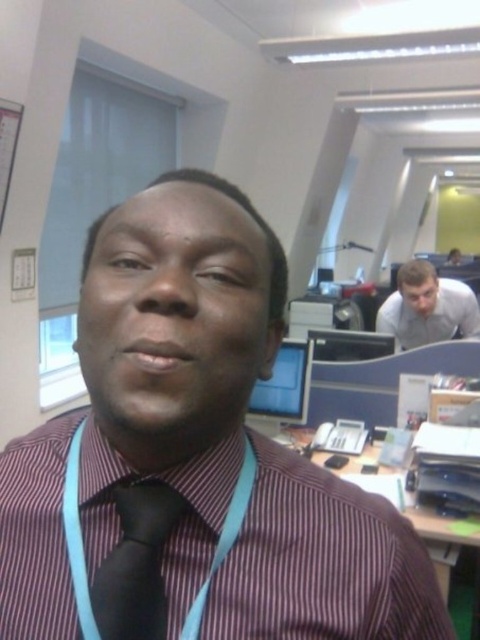
Between point (362, 589) and point (479, 545), which one is positioned behind?

Point (479, 545)

Is striped cotton shirt at center to the right of wooden desk at center from the viewer's perspective?

In fact, striped cotton shirt at center is to the left of wooden desk at center.

Who is more forward, (264, 496) or (302, 428)?

Point (264, 496)

Image resolution: width=480 pixels, height=640 pixels. Find the location of `striped cotton shirt at center`. striped cotton shirt at center is located at coordinates (322, 563).

Is maroon striped shirt at center thinner than white glossy shirt at upper right?

Yes.

Who is more distant from viewer, [251,588] or [400,333]?

The point [400,333] is behind.

Does point (212, 356) come farther from viewer compared to point (388, 332)?

No.

The image size is (480, 640). I want to click on maroon striped shirt at center, so click(192, 458).

Does white glossy shirt at upper right have a greater width compared to matte black monitor at center?

Correct, the width of white glossy shirt at upper right exceeds that of matte black monitor at center.

In the scene shown: Who is shorter, white glossy shirt at upper right or matte black monitor at center?

Standing shorter between the two is matte black monitor at center.

Measure the distance between white glossy shirt at upper right and camera.

white glossy shirt at upper right is 9.71 feet from camera.

Where is `white glossy shirt at upper right`? This screenshot has width=480, height=640. white glossy shirt at upper right is located at coordinates (427, 307).